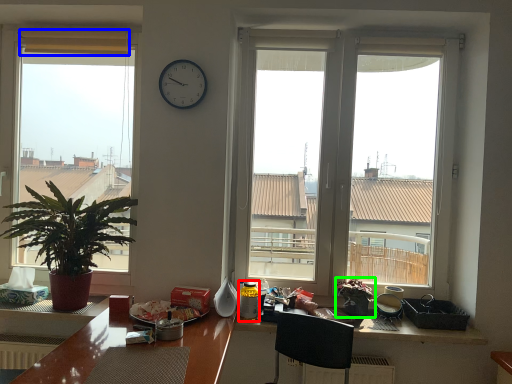
Question: Estimate the real-world distances between objects in this image. Which object is closer to bottle (highlighted by a red box), curtain (highlighted by a blue box) or houseplant (highlighted by a green box)?

Choices:
 (A) curtain
 (B) houseplant

Answer: (B)